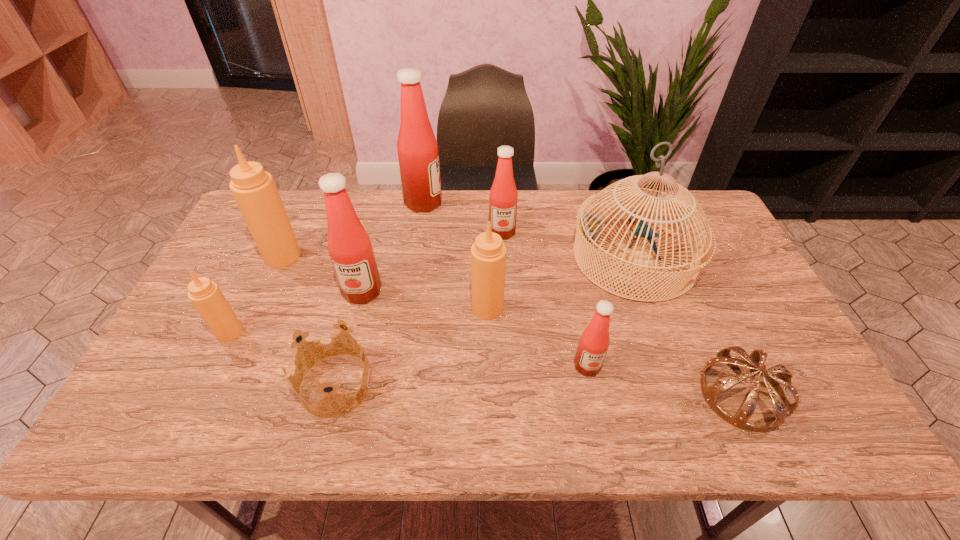
This screenshot has height=540, width=960. What are the coordinates of `birdcage that is positioned at the right edge` in the screenshot? It's located at (589, 228).

Find the location of a particular element. The height and width of the screenshot is (540, 960). tiara that is positioned at the right edge is located at coordinates (782, 407).

Find the location of a particular element. object present at the far right corner is located at coordinates (589, 228).

The image size is (960, 540). What are the coordinates of `object at the near right corner` in the screenshot? It's located at (782, 407).

Locate an element on the screen. This screenshot has height=540, width=960. vacant space at the far edge of the desktop is located at coordinates (447, 209).

Image resolution: width=960 pixels, height=540 pixels. What are the coordinates of `vacant point at the near edge` in the screenshot? It's located at (370, 421).

This screenshot has height=540, width=960. In the image, there is a desktop. Find the location of `vacant region at the left edge`. vacant region at the left edge is located at coordinates (146, 387).

Find the location of a particular element. The height and width of the screenshot is (540, 960). vacant space at the right edge of the desktop is located at coordinates (747, 286).

Image resolution: width=960 pixels, height=540 pixels. Identify the location of free space at the far left corner of the desktop. (300, 198).

The image size is (960, 540). I want to click on vacant area that lies between the third farthest condiment and the third nearest red condiment, so click(x=393, y=244).